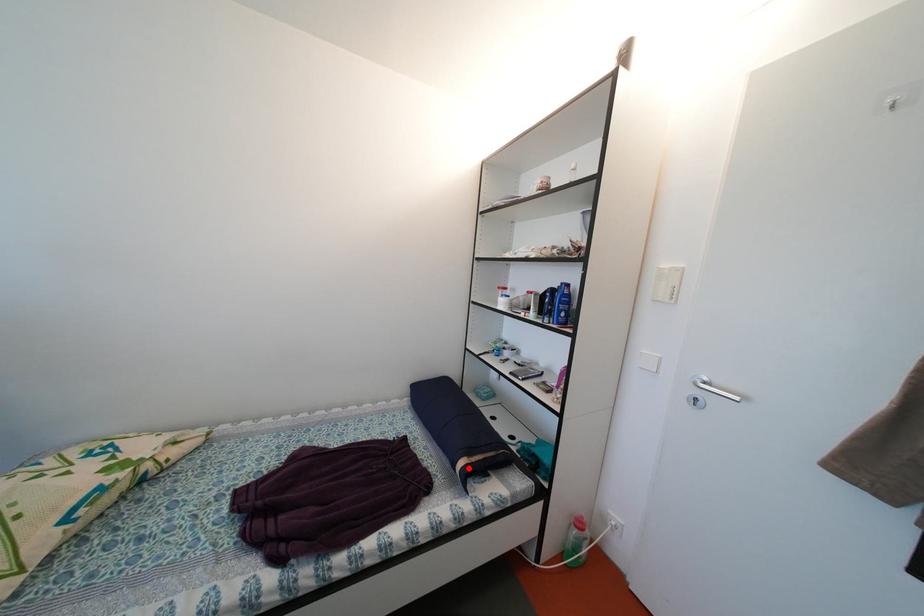
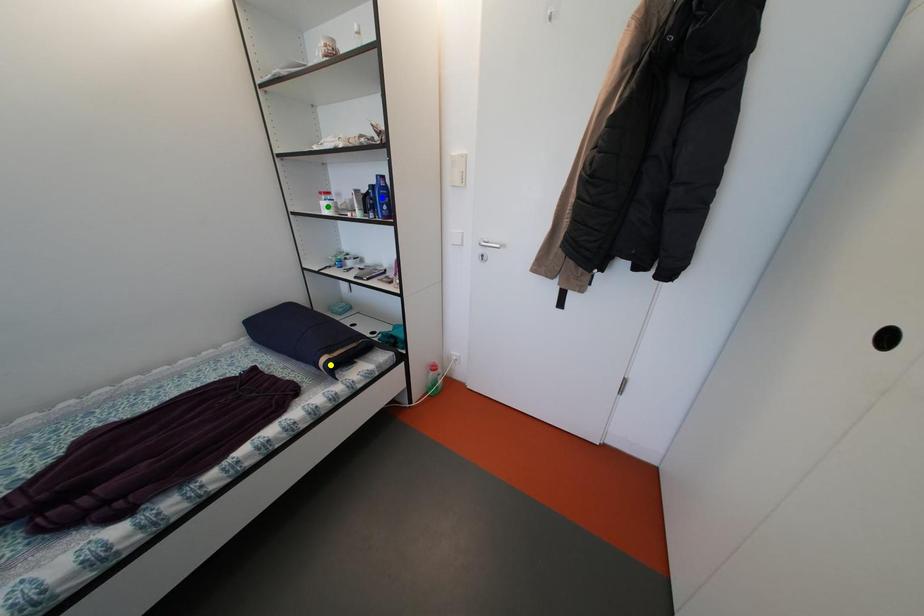
Question: I am providing you with two images of the same scene from different viewpoints. A red point is marked on the first image. You are given multiple points on the second image. Which point in image 2 represents the same 3d spot as the red point in image 1?

Choices:
 (A) green point
 (B) blue point
 (C) yellow point

Answer: (C)